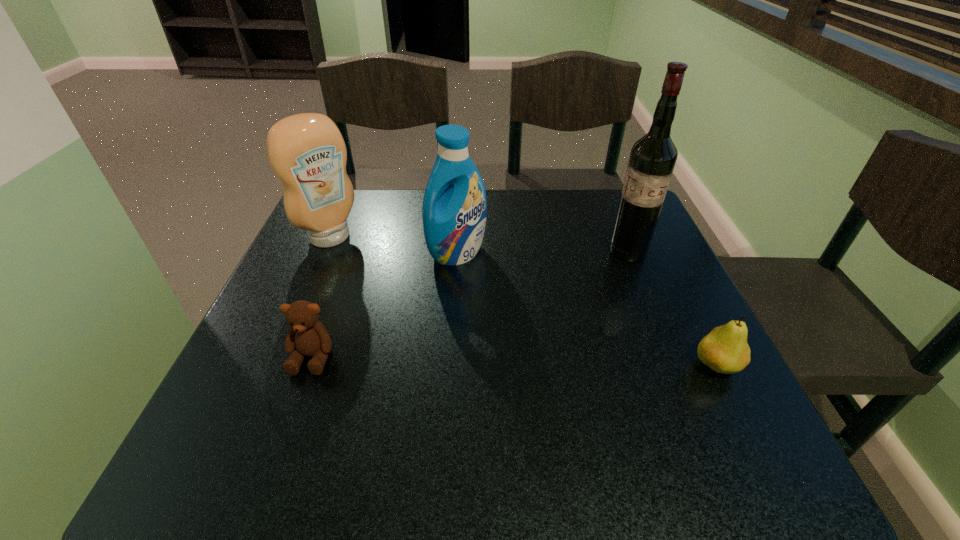
Where is `teddy bear`? teddy bear is located at coordinates (307, 337).

The width and height of the screenshot is (960, 540). Identify the location of pear. (725, 350).

Find the location of a particular element. This screenshot has height=540, width=960. the tallest object is located at coordinates [652, 159].

This screenshot has width=960, height=540. I want to click on the third object from right to left, so click(x=454, y=208).

The height and width of the screenshot is (540, 960). Identify the location of condiment. (307, 153).

In order to click on vacant space located on the face of the teddy bear in this screenshot , I will do `click(293, 412)`.

Find the location of `free space located on the back of the pear`. free space located on the back of the pear is located at coordinates (689, 313).

You are a GUI agent. You are given a task and a screenshot of the screen. Output one action in this format:
    pyautogui.click(x=<x>, y=<y>)
    Task: Click on the vacant space located 0.050m on the front and back of the tallest object
    
    Given the screenshot: What is the action you would take?
    pyautogui.click(x=612, y=272)

The image size is (960, 540). I want to click on vacant position located on the front and back of the tallest object, so click(x=561, y=336).

Locate an element on the screen. This screenshot has width=960, height=540. free space located 0.300m on the front and back of the tallest object is located at coordinates (558, 340).